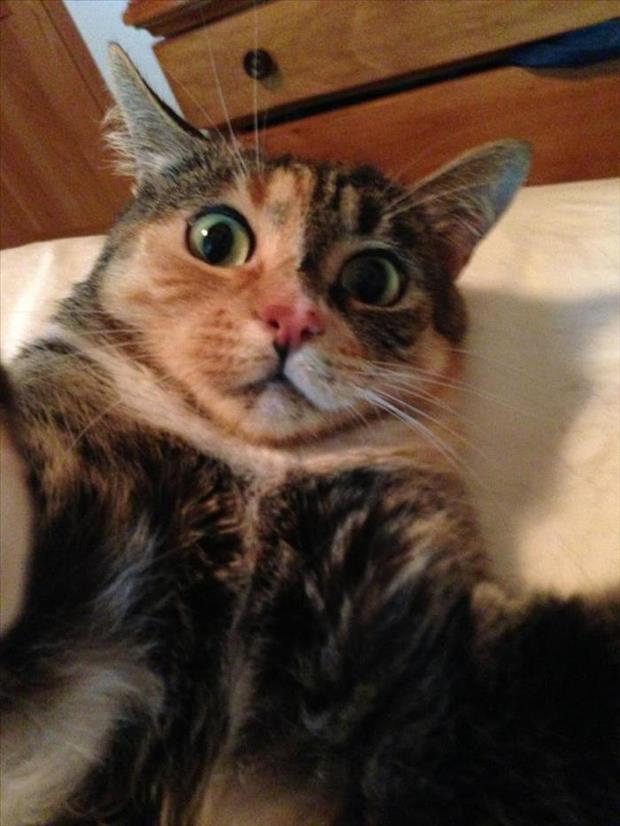
The image size is (620, 826). I want to click on white sheet on bed, so click(x=512, y=496).